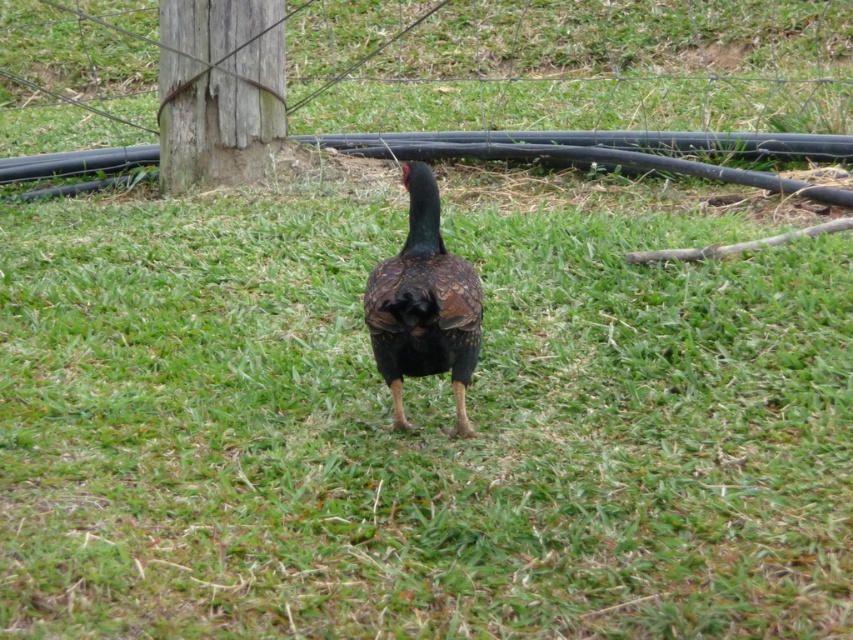
Question: Does wooden post at center appear over shiny brown bird at center?

Choices:
 (A) yes
 (B) no

Answer: (A)

Question: Can you confirm if wooden post at center is bigger than shiny brown bird at center?

Choices:
 (A) no
 (B) yes

Answer: (A)

Question: Which of the following is the farthest from the observer?

Choices:
 (A) shiny brown bird at center
 (B) wooden post at center

Answer: (B)

Question: Where is wooden post at center located in relation to shiny brown bird at center in the image?

Choices:
 (A) below
 (B) above

Answer: (B)

Question: Among these objects, which one is nearest to the camera?

Choices:
 (A) wooden post at center
 (B) shiny brown bird at center

Answer: (B)